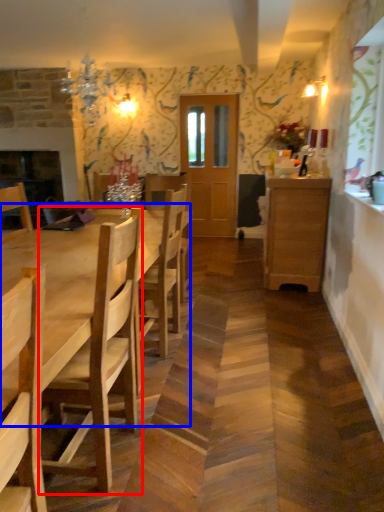
Question: Which of the following is the farthest to the observer, chair (highlighted by a red box) or kitchen & dining room table (highlighted by a blue box)?

Choices:
 (A) chair
 (B) kitchen & dining room table

Answer: (A)